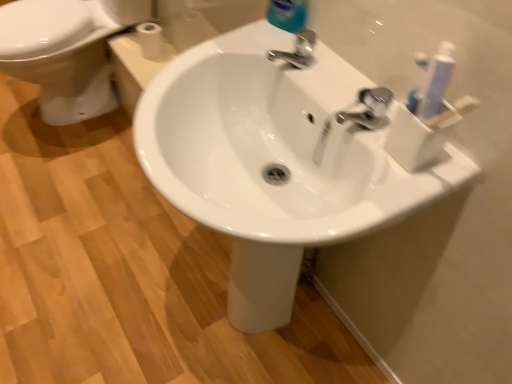
Consider the image. Measure the distance between white matte toilet paper at upper left and camera.

white matte toilet paper at upper left and camera are 5.01 feet apart from each other.

The height and width of the screenshot is (384, 512). Describe the element at coordinates (60, 56) in the screenshot. I see `white glossy bidet at left` at that location.

Locate an element on the screen. The width and height of the screenshot is (512, 384). silver metallic faucet at upper center, positioned as the 1th tap in top-to-bottom order is located at coordinates (297, 51).

Considering the positions of objects polished chrome faucet at upper right, positioned as the first tap in bottom-to-top order, and white matte toilet paper at upper left in the image provided, who is in front, polished chrome faucet at upper right, positioned as the first tap in bottom-to-top order, or white matte toilet paper at upper left?

polished chrome faucet at upper right, positioned as the first tap in bottom-to-top order.

Which is closer to the camera, (380, 109) or (145, 56)?

Clearly, point (380, 109) is closer to the camera than point (145, 56).

From the image's perspective, who appears lower, polished chrome faucet at upper right, which is the 2th tap from left to right, or white matte toilet paper at upper left?

polished chrome faucet at upper right, which is the 2th tap from left to right, is shown below in the image.

From a real-world perspective, is polished chrome faucet at upper right, which is counted as the first tap, starting from the right, physically above white matte toilet paper at upper left?

Yes, from a real-world perspective, polished chrome faucet at upper right, which is counted as the first tap, starting from the right, is above white matte toilet paper at upper left.

Between polished chrome faucet at upper right, positioned as the first tap in bottom-to-top order, and white glossy sink at center, which one is positioned behind?

polished chrome faucet at upper right, positioned as the first tap in bottom-to-top order.

Can you confirm if polished chrome faucet at upper right, the 2th tap viewed from the back, is thinner than white glossy sink at center?

Correct, the width of polished chrome faucet at upper right, the 2th tap viewed from the back, is less than that of white glossy sink at center.

Does polished chrome faucet at upper right, the 2th tap viewed from the back, appear on the right side of white glossy sink at center?

Yes, polished chrome faucet at upper right, the 2th tap viewed from the back, is to the right of white glossy sink at center.

In the scene shown: From the image's perspective, which one is positioned higher, polished chrome faucet at upper right, acting as the 1th tap starting from the front, or white glossy sink at center?

From the image's view, polished chrome faucet at upper right, acting as the 1th tap starting from the front, is above.

How much distance is there between blue glossy bottle at upper center and white glossy sink at center?

blue glossy bottle at upper center is 35.57 centimeters away from white glossy sink at center.

Could you tell me if blue glossy bottle at upper center is facing white glossy sink at center?

No, blue glossy bottle at upper center is not oriented towards white glossy sink at center.

In terms of width, does blue glossy bottle at upper center look wider or thinner when compared to white glossy sink at center?

Considering their sizes, blue glossy bottle at upper center looks slimmer than white glossy sink at center.

In terms of width, does silver metallic faucet at upper center, which is the first tap from back to front, look wider or thinner when compared to polished chrome faucet at upper right, which is the 2th tap from left to right?

silver metallic faucet at upper center, which is the first tap from back to front, is thinner than polished chrome faucet at upper right, which is the 2th tap from left to right.

From the picture: From a real-world perspective, who is located lower, silver metallic faucet at upper center, positioned as the 1th tap in top-to-bottom order, or polished chrome faucet at upper right, which appears as the second tap when viewed from the top?

In real-world perspective, silver metallic faucet at upper center, positioned as the 1th tap in top-to-bottom order, is lower.

Could you tell me if silver metallic faucet at upper center, positioned as the 2th tap in front-to-back order, is turned towards polished chrome faucet at upper right, acting as the 1th tap starting from the front?

No.

Considering the points (303, 56) and (349, 117), which point is in front, point (303, 56) or point (349, 117)?

The point (349, 117) is in front.

Is polished chrome faucet at upper right, which is the 2th tap from left to right, to the left of white glossy bidet at left from the viewer's perspective?

In fact, polished chrome faucet at upper right, which is the 2th tap from left to right, is to the right of white glossy bidet at left.

From the image's perspective, is polished chrome faucet at upper right, which is the 2th tap from left to right, positioned above or below white glossy bidet at left?

polished chrome faucet at upper right, which is the 2th tap from left to right, is below white glossy bidet at left.

Which object is closer to the camera, polished chrome faucet at upper right, acting as the 1th tap starting from the front, or white glossy bidet at left?

polished chrome faucet at upper right, acting as the 1th tap starting from the front, is more forward.

Is polished chrome faucet at upper right, which appears as the second tap when viewed from the top, positioned beyond the bounds of white glossy bidet at left?

That's correct, polished chrome faucet at upper right, which appears as the second tap when viewed from the top, is outside of white glossy bidet at left.

Considering the relative sizes of blue glossy bottle at upper center and white glossy bidet at left in the image provided, is blue glossy bottle at upper center smaller than white glossy bidet at left?

Yes, blue glossy bottle at upper center is smaller than white glossy bidet at left.

Based on the photo, from a real-world perspective, is blue glossy bottle at upper center physically located above or below white glossy bidet at left?

In terms of real-world spatial position, blue glossy bottle at upper center is above white glossy bidet at left.

Are blue glossy bottle at upper center and white glossy bidet at left far apart?

Yes, blue glossy bottle at upper center is far from white glossy bidet at left.

Is white glossy sink at center beside silver metallic faucet at upper center, positioned as the 2th tap in front-to-back order?

No, white glossy sink at center is not touching silver metallic faucet at upper center, positioned as the 2th tap in front-to-back order.

In the scene shown: Does white glossy sink at center have a larger size compared to silver metallic faucet at upper center, the 2th tap in the right-to-left sequence?

Correct, white glossy sink at center is larger in size than silver metallic faucet at upper center, the 2th tap in the right-to-left sequence.

Is white glossy sink at center behind silver metallic faucet at upper center, positioned as the 1th tap in top-to-bottom order?

No, white glossy sink at center is in front of silver metallic faucet at upper center, positioned as the 1th tap in top-to-bottom order.

This screenshot has height=384, width=512. Find the location of `the 2nd tap to the right when counting from the white matte toilet paper at upper left`. the 2nd tap to the right when counting from the white matte toilet paper at upper left is located at coordinates (369, 109).

Locate an element on the screen. The width and height of the screenshot is (512, 384). the 1st tap above the white glossy sink at center (from the image's perspective) is located at coordinates (369, 109).

From the image, which object appears to be farther from white glossy sink at center, silver metallic faucet at upper center, positioned as the 2th tap in front-to-back order, or white matte toilet paper at upper left?

Based on the image, white matte toilet paper at upper left appears to be further to white glossy sink at center.

Considering their positions, is white glossy bidet at left positioned further to polished chrome faucet at upper right, which appears as the second tap when viewed from the top, than white glossy sink at center?

white glossy bidet at left is further to polished chrome faucet at upper right, which appears as the second tap when viewed from the top.

Based on their spatial positions, is white glossy sink at center or polished chrome faucet at upper right, the 2th tap viewed from the back, closer to silver metallic faucet at upper center, which is the 1th tap from left to right?

The object closer to silver metallic faucet at upper center, which is the 1th tap from left to right, is polished chrome faucet at upper right, the 2th tap viewed from the back.

Looking at the image, which one is located closer to silver metallic faucet at upper center, positioned as the 1th tap in top-to-bottom order, white glossy sink at center or white matte toilet paper at upper left?

white glossy sink at center is closer to silver metallic faucet at upper center, positioned as the 1th tap in top-to-bottom order.

From the image, which object appears to be nearer to polished chrome faucet at upper right, acting as the 1th tap starting from the front, white matte toilet paper at upper left or white glossy bidet at left?

white matte toilet paper at upper left lies closer to polished chrome faucet at upper right, acting as the 1th tap starting from the front, than the other object.

Which object lies nearer to the anchor point silver metallic faucet at upper center, which is the first tap from back to front, white matte toilet paper at upper left or white glossy bidet at left?

white matte toilet paper at upper left.

Consider the image. From the image, which object appears to be nearer to white glossy sink at center, white glossy bidet at left or white matte toilet paper at upper left?

white matte toilet paper at upper left is closer to white glossy sink at center.

Looking at the image, which one is located further to white glossy sink at center, blue glossy bottle at upper center or white glossy bidet at left?

white glossy bidet at left is further to white glossy sink at center.

The height and width of the screenshot is (384, 512). I want to click on bidet positioned between white glossy sink at center and white matte toilet paper at upper left from near to far, so click(x=60, y=56).

At what (x,y) coordinates should I click in order to perform the action: click on sink situated between white glossy bidet at left and blue glossy bottle at upper center from left to right. Please return your answer as a coordinate pair (x, y). The image size is (512, 384). Looking at the image, I should click on (274, 161).

Identify the location of tap located between polished chrome faucet at upper right, which is counted as the first tap, starting from the right, and white matte toilet paper at upper left in the depth direction. (297, 51).

At what (x,y) coordinates should I click in order to perform the action: click on cleaning product located between white glossy bidet at left and silver metallic faucet at upper center, which is the 1th tap from left to right, in the left-right direction. Please return your answer as a coordinate pair (x, y). Looking at the image, I should click on (287, 14).